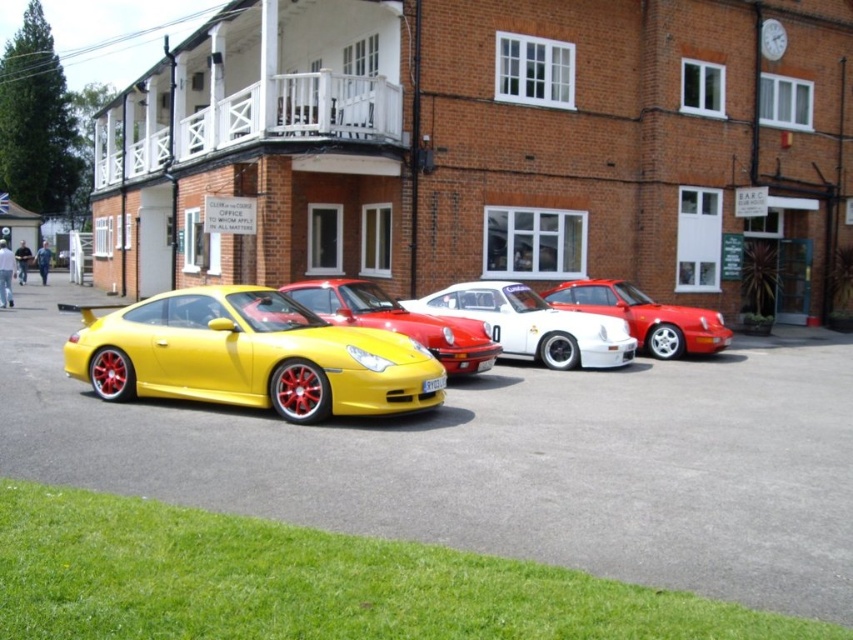
Between matte yellow sports car at left and yellow matte sports car at center, which one appears on the right side from the viewer's perspective?

yellow matte sports car at center is more to the right.

Based on the photo, which is above, matte yellow sports car at left or yellow matte sports car at center?

matte yellow sports car at left is above.

What do you see at coordinates (248, 355) in the screenshot? I see `matte yellow sports car at left` at bounding box center [248, 355].

The height and width of the screenshot is (640, 853). Find the location of `matte yellow sports car at left`. matte yellow sports car at left is located at coordinates (248, 355).

Where is `matte yellow sports car at left`? The width and height of the screenshot is (853, 640). matte yellow sports car at left is located at coordinates (248, 355).

Who is more forward, [322,378] or [602,291]?

Point [322,378]

Which is behind, point (358, 374) or point (650, 344)?

The point (650, 344) is behind.

You are a GUI agent. You are given a task and a screenshot of the screen. Output one action in this format:
    pyautogui.click(x=<x>, y=<y>)
    Task: Click on the matte yellow sports car at left
    
    Given the screenshot: What is the action you would take?
    pyautogui.click(x=248, y=355)

Does point (360, 312) come in front of point (614, 308)?

Yes, it is in front of point (614, 308).

Does yellow matte sports car at center have a greater width compared to shiny red porsche at center?

No, yellow matte sports car at center is not wider than shiny red porsche at center.

Between point (419, 314) and point (683, 307), which one is positioned behind?

Positioned behind is point (683, 307).

The width and height of the screenshot is (853, 640). I want to click on yellow matte sports car at center, so click(398, 321).